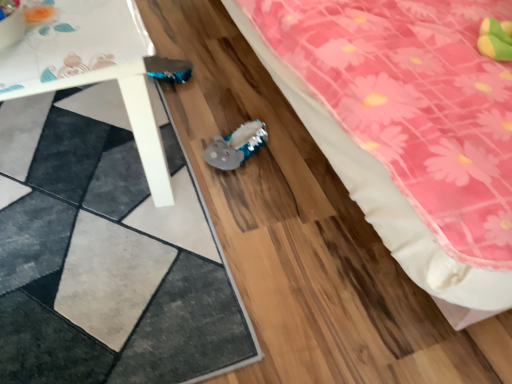
I want to click on free spot behind fuzzy fabric plushie at center, so click(x=232, y=112).